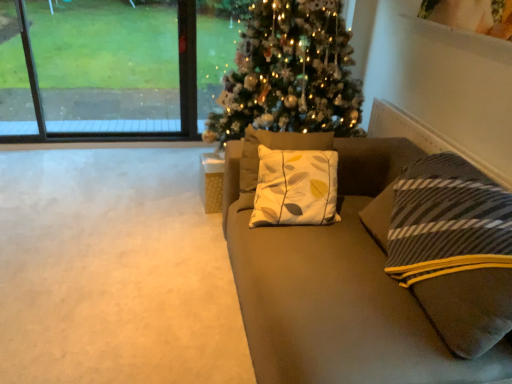
Question: Is suede couch at center shorter than wooden cube at center?

Choices:
 (A) no
 (B) yes

Answer: (A)

Question: Does suede couch at center lie behind wooden cube at center?

Choices:
 (A) no
 (B) yes

Answer: (A)

Question: Is suede couch at center positioned far away from wooden cube at center?

Choices:
 (A) no
 (B) yes

Answer: (A)

Question: Is suede couch at center thinner than wooden cube at center?

Choices:
 (A) yes
 (B) no

Answer: (B)

Question: From the image's perspective, is suede couch at center on top of wooden cube at center?

Choices:
 (A) no
 (B) yes

Answer: (A)

Question: Would you say suede couch at center is inside or outside iridescent glass christmas tree at center?

Choices:
 (A) outside
 (B) inside

Answer: (A)

Question: From a real-world perspective, relative to iridescent glass christmas tree at center, is suede couch at center vertically above or below?

Choices:
 (A) below
 (B) above

Answer: (A)

Question: Looking at their shapes, would you say suede couch at center is wider or thinner than iridescent glass christmas tree at center?

Choices:
 (A) thin
 (B) wide

Answer: (A)

Question: Relative to iridescent glass christmas tree at center, is suede couch at center in front or behind?

Choices:
 (A) behind
 (B) front

Answer: (B)

Question: Considering the positions of iridescent glass christmas tree at center and wooden cube at center in the image, is iridescent glass christmas tree at center taller or shorter than wooden cube at center?

Choices:
 (A) tall
 (B) short

Answer: (A)

Question: Looking at their shapes, would you say iridescent glass christmas tree at center is wider or thinner than wooden cube at center?

Choices:
 (A) wide
 (B) thin

Answer: (A)

Question: Is iridescent glass christmas tree at center in front of or behind wooden cube at center in the image?

Choices:
 (A) front
 (B) behind

Answer: (A)

Question: From a real-world perspective, relative to wooden cube at center, is iridescent glass christmas tree at center vertically above or below?

Choices:
 (A) below
 (B) above

Answer: (B)

Question: Looking at their shapes, would you say wooden cube at center is wider or thinner than suede couch at center?

Choices:
 (A) thin
 (B) wide

Answer: (A)

Question: From a real-world perspective, is wooden cube at center positioned above or below suede couch at center?

Choices:
 (A) above
 (B) below

Answer: (B)